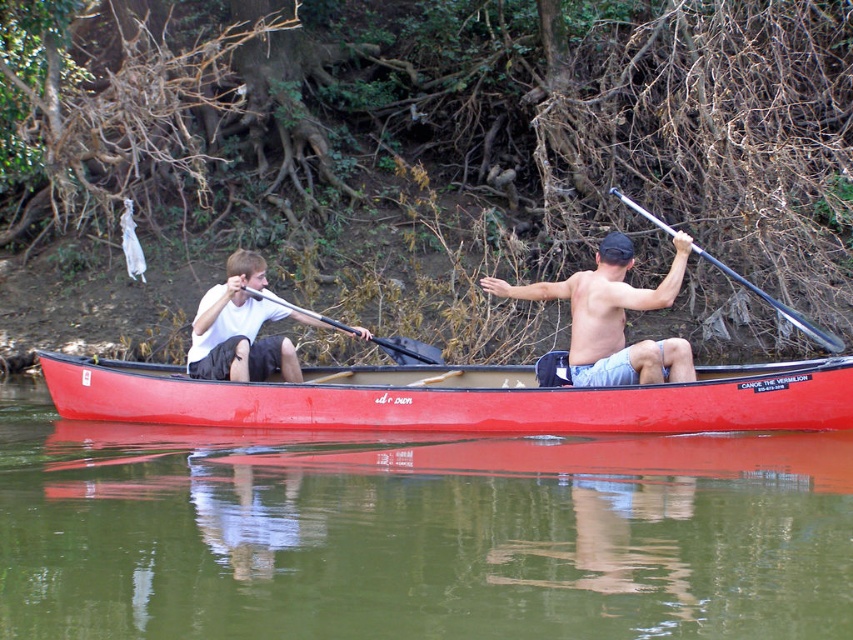
You are standing at the camera position and want to throw a lifebuoy to the point marked as point (x=251, y=269). What is the minimum distance you need to throw the lifebuoy?

The minimum distance you need to throw the lifebuoy to reach point (x=251, y=269) is 10.69 meters.

You are planning to place a small floating dock on the green smooth water at center. Considering the size of the water area compared to the matte red canoe at center, will the dock fit if it is the same width as the canoe?

The green smooth water at center is thinner than the matte red canoe at center, so if the dock is the same width as the canoe, it will not fit within the water area since the water is narrower than the canoe.

You are a photographer trying to capture the canoe in the image. The photographer wants to know if the point at coordinates [416,532] is the location of the green smooth water at center. Can you confirm this?

Yes, the point at coordinates [416,532] is the location of the green smooth water at center.